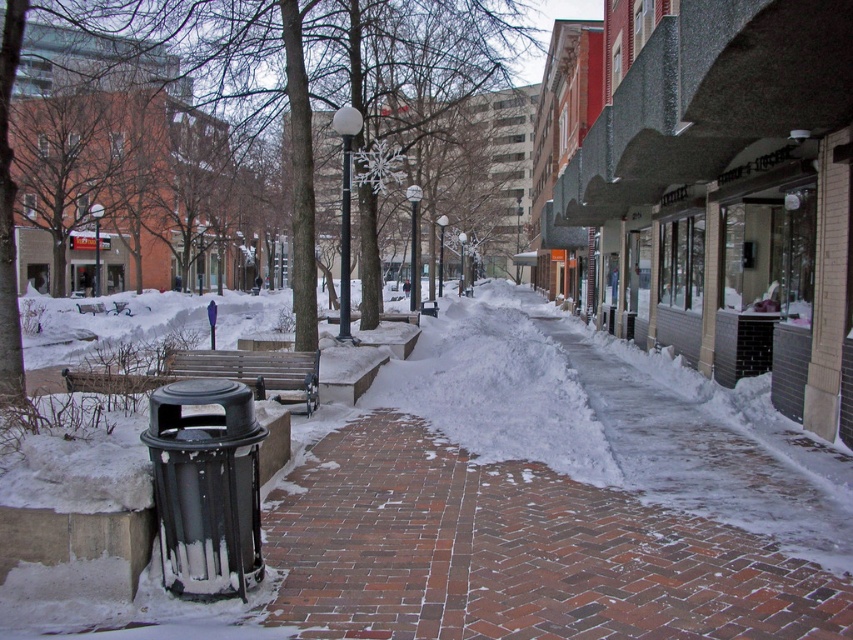
You are a snowplow operator who needs to clear snow from the brick pavement at center and the wooden bench at center. Based on the scene description, which object requires more snow to be removed?

The wooden bench at center requires more snow to be removed because it is larger than the brick pavement at center according to the description.